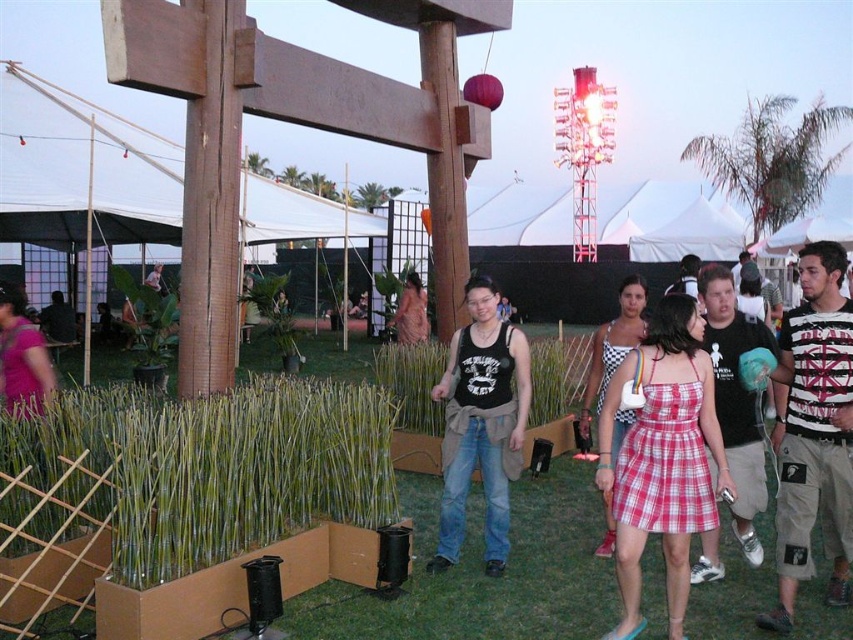
Question: Which object is the farthest from the red plaid dress at center?

Choices:
 (A) black cotton tank top at center
 (B) striped cotton t-shirt at center
 (C) plaid cotton dress at center

Answer: (C)

Question: Which is farther from the red plaid dress at center?

Choices:
 (A) black cotton tank top at center
 (B) black tank top at center

Answer: (B)

Question: Does white fabric canopy at center appear on the right side of black cotton tank top at center?

Choices:
 (A) no
 (B) yes

Answer: (A)

Question: Considering the relative positions of red plaid dress at center and matte black tank top at center in the image provided, where is red plaid dress at center located with respect to matte black tank top at center?

Choices:
 (A) right
 (B) left

Answer: (A)

Question: Among these points, which one is farthest from the camera?

Choices:
 (A) (711, 369)
 (B) (715, 577)
 (C) (102, 211)
 (D) (817, 346)

Answer: (C)

Question: Can you confirm if striped cotton t-shirt at center is smaller than black tank top at center?

Choices:
 (A) no
 (B) yes

Answer: (B)